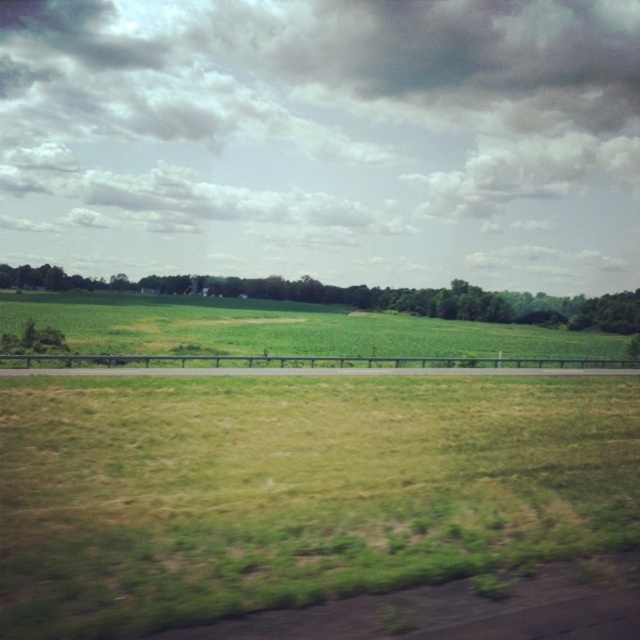
You are standing at the origin point in the image. Which direction should you move to reach the green grassy field at lower center?

The green grassy field at lower center is located at coordinates point (294, 490), so you should move towards the lower center direction to reach it.

You are standing on the road behind the metal guardrail and see the green grassy field at lower center and the green leafy tree at center. Which object is closer to your right side?

The green grassy field at lower center is closer to your right side because it is positioned to the right of the green leafy tree at center.

You are a landscape architect designing a walking path through the rural area shown. You need to ensure the path is wide enough for two people to walk side by side. The path will be placed between the green grassy field at lower center and the green leafy tree at center. Given that two people walking side by side require a minimum of 1.5 meters of space, can the existing space between these two features accommodate this requirement?

The green grassy field at lower center is thinner than the green leafy tree at center. However, the description does not provide specific measurements of the space between them. Without knowing the exact distance, it is impossible to determine if it meets the 1.5 meters requirement. Additional measurements are needed.